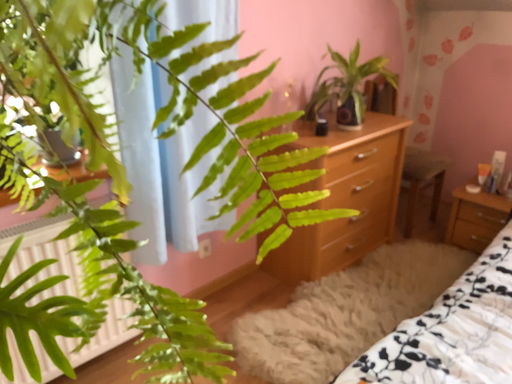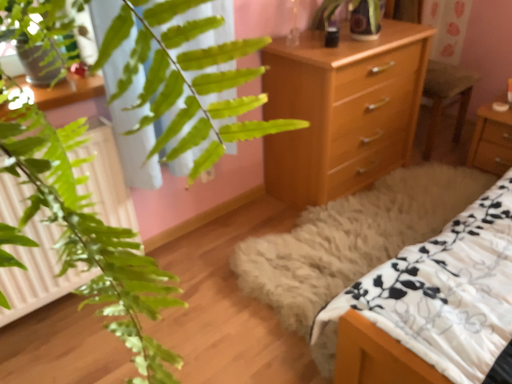
Question: Which way did the camera rotate in the video?

Choices:
 (A) rotated upward
 (B) rotated downward

Answer: (B)